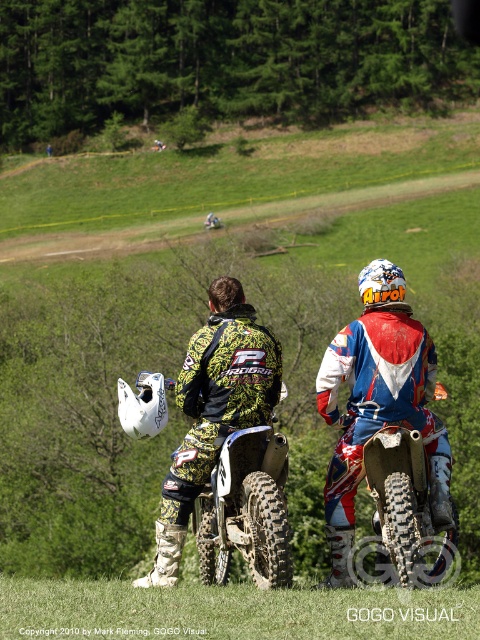
Who is more forward, (67, 609) or (410, 484)?

Positioned in front is point (67, 609).

Between green grass at lower center and red and white motocross bike at center, which one appears on the right side from the viewer's perspective?

From the viewer's perspective, red and white motocross bike at center appears more on the right side.

Who is more distant from viewer, (379,600) or (376,474)?

→ The point (376,474) is behind.

Identify the location of green grass at lower center. This screenshot has width=480, height=640. (230, 611).

Which is behind, point (79, 609) or point (171, 577)?

Positioned behind is point (171, 577).

Is green grass at lower center smaller than camouflage fabric jacket at center?

Yes.

Does point (327, 618) come closer to viewer compared to point (216, 436)?

Yes, point (327, 618) is closer to viewer.

In order to click on green grass at lower center in this screenshot , I will do `click(230, 611)`.

Who is more distant from viewer, (236, 522) or (376, 637)?

Point (236, 522)

Where is `camouflage-patterned dirt bike at center`? The width and height of the screenshot is (480, 640). camouflage-patterned dirt bike at center is located at coordinates (384, 426).

Who is more forward, (415,556) or (250,604)?

Point (250,604) is more forward.

Where is `camouflage-patterned dirt bike at center`? This screenshot has height=640, width=480. camouflage-patterned dirt bike at center is located at coordinates (384, 426).